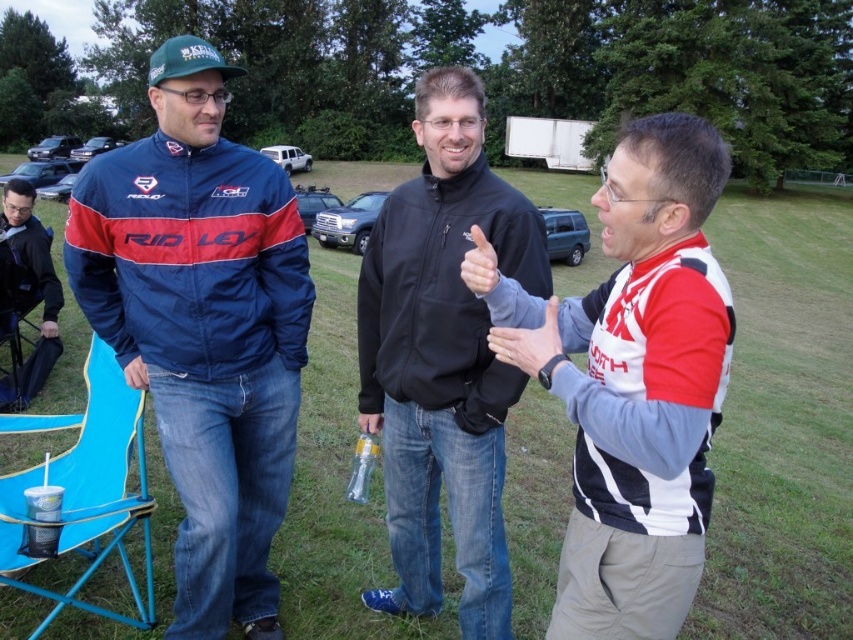
Does matte blue jacket at left appear on the right side of white and black jersey at right?

In fact, matte blue jacket at left is to the left of white and black jersey at right.

Does point (196, 328) come farther from viewer compared to point (462, 278)?

Yes.

At what (x,y) coordinates should I click in order to perform the action: click on matte blue jacket at left. Please return your answer as a coordinate pair (x, y). Looking at the image, I should click on (202, 326).

Is matte blue jacket at left positioned at the back of clear plastic bottle at center?

No, matte blue jacket at left is closer to the viewer.

Which of these two, matte blue jacket at left or clear plastic bottle at center, stands shorter?

Standing shorter between the two is clear plastic bottle at center.

Between point (216, 216) and point (364, 458), which one is positioned in front?

Positioned in front is point (216, 216).

At what (x,y) coordinates should I click in order to perform the action: click on matte blue jacket at left. Please return your answer as a coordinate pair (x, y). Image resolution: width=853 pixels, height=640 pixels. Looking at the image, I should click on (202, 326).

Who is taller, black softshell jacket at center or black fabric chair at lower left?

black softshell jacket at center is taller.

Does point (463, 284) lie in front of point (9, 257)?

That is True.

Where is `black softshell jacket at center`? The height and width of the screenshot is (640, 853). black softshell jacket at center is located at coordinates (444, 358).